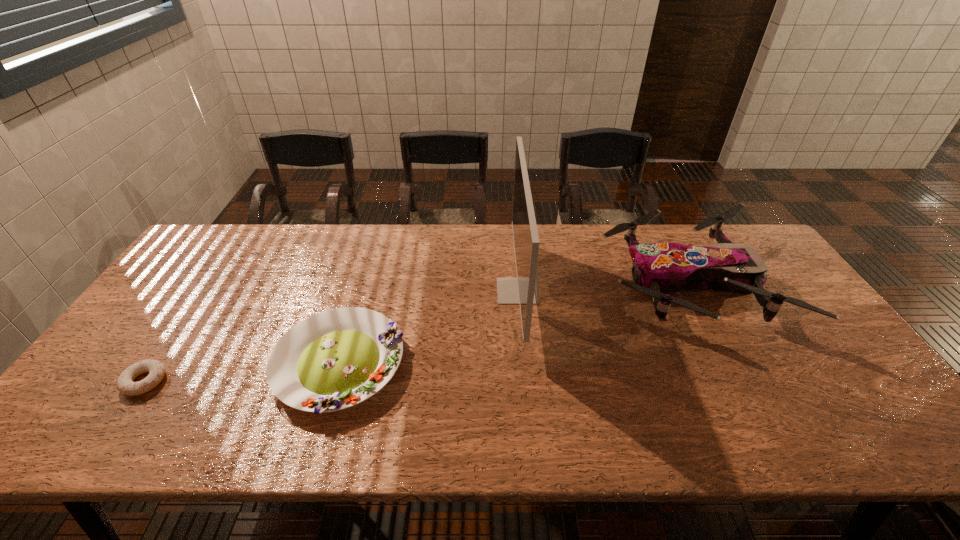
You are a GUI agent. You are given a task and a screenshot of the screen. Output one action in this format:
    pyautogui.click(x=<x>, y=<y>)
    Task: Click on the free space located on the front-facing side of the third object from left to right
    The width and height of the screenshot is (960, 540).
    Given the screenshot: What is the action you would take?
    pyautogui.click(x=403, y=291)

You are a GUI agent. You are given a task and a screenshot of the screen. Output one action in this format:
    pyautogui.click(x=<x>, y=<y>)
    Task: Click on the free region located on the front-facing side of the rightmost object
    The height and width of the screenshot is (540, 960).
    Given the screenshot: What is the action you would take?
    pyautogui.click(x=543, y=282)

You are a GUI agent. You are given a task and a screenshot of the screen. Output one action in this format:
    pyautogui.click(x=<x>, y=<y>)
    Task: Click on the vacant space situated on the front-facing side of the rightmost object
    The height and width of the screenshot is (540, 960).
    Given the screenshot: What is the action you would take?
    pyautogui.click(x=580, y=282)

This screenshot has height=540, width=960. I want to click on vacant space situated 0.090m on the front-facing side of the rightmost object, so (x=573, y=282).

This screenshot has width=960, height=540. Identify the location of vacant space located 0.190m on the right of the salad plate. tap(479, 364).

Identify the location of vacant space situated 0.200m on the right of the shortest object. The image size is (960, 540). (248, 381).

You are a GUI agent. You are given a task and a screenshot of the screen. Output one action in this format:
    pyautogui.click(x=<x>, y=<y>)
    Task: Click on the monitor positioned at the far edge
    
    Given the screenshot: What is the action you would take?
    pyautogui.click(x=524, y=290)

You are a GUI agent. You are given a task and a screenshot of the screen. Output one action in this format:
    pyautogui.click(x=<x>, y=<y>)
    Task: Click on the drone present at the far edge
    The image size is (960, 540).
    Given the screenshot: What is the action you would take?
    pyautogui.click(x=657, y=268)

I want to click on object at the near edge, so 335,359.

Where is `object present at the left edge`? object present at the left edge is located at coordinates (156, 369).